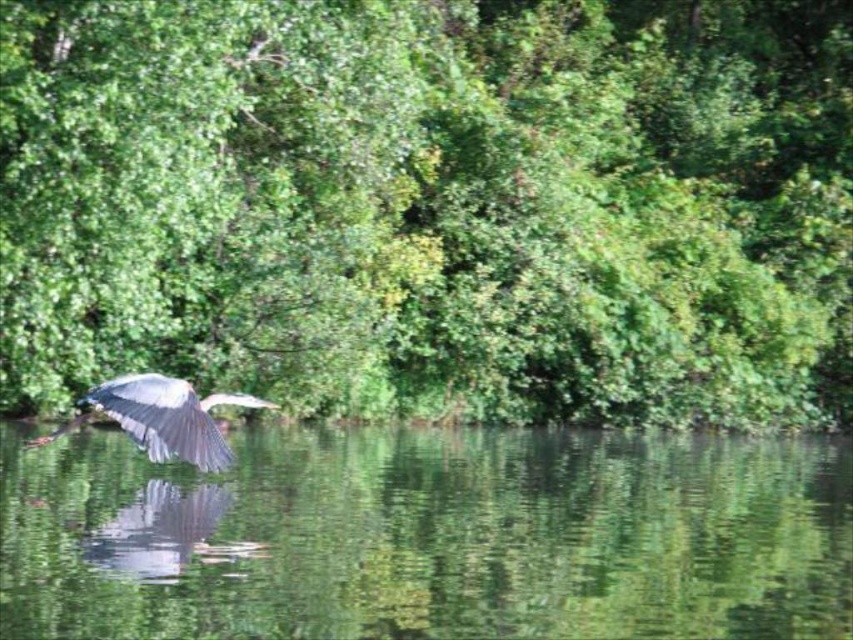
You are a photographer aiming to capture the gray feathered bird at left while ensuring the green leafy trees at upper center are visible in the background. Is the bird positioned below the trees?

The green leafy trees at upper center are above the gray feathered bird at left, so yes, the bird is positioned below the trees, making it possible to have the trees in the background of the photo.

You are a drone operator trying to capture a photo of the bird in flight. The drone is currently at position coordinates of point A. You need to adjust the drone to the position of the green leafy trees at upper center to get the perfect shot. What coordinates should you adjust the drone to?

The green leafy trees at upper center are located at coordinates point (433, 205). Adjust the drone to this position to capture the shot.